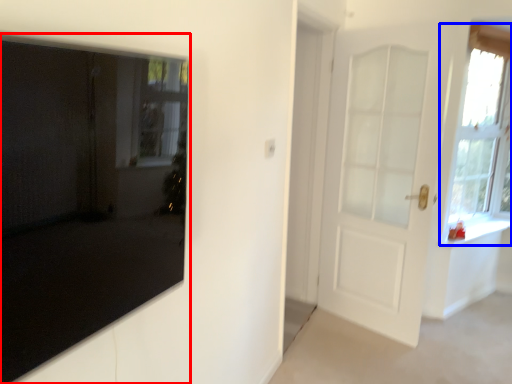
Question: Which of the following is the closest to the observer, door (highlighted by a red box) or window (highlighted by a blue box)?

Choices:
 (A) door
 (B) window

Answer: (A)